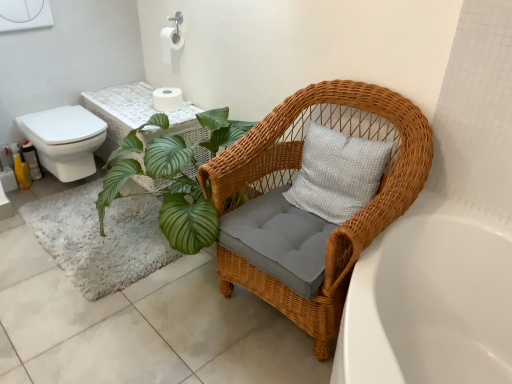
Identify the location of vacant space situated on the left part of white matte toilet paper at upper center, the 1th toilet paper positioned from the bottom. click(x=141, y=100).